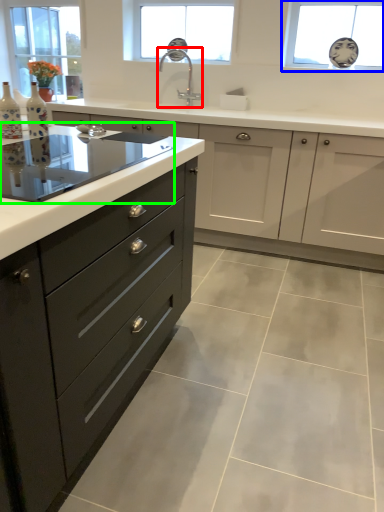
Question: Which object is the closest to the sink (highlighted by a red box)? Choose among these: window (highlighted by a blue box) or home appliance (highlighted by a green box).

Choices:
 (A) window
 (B) home appliance

Answer: (A)